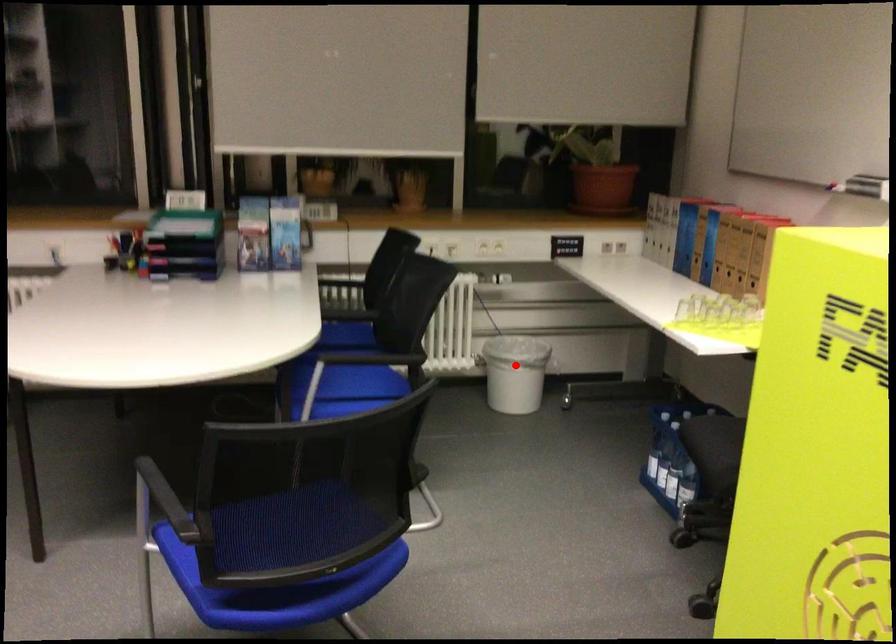
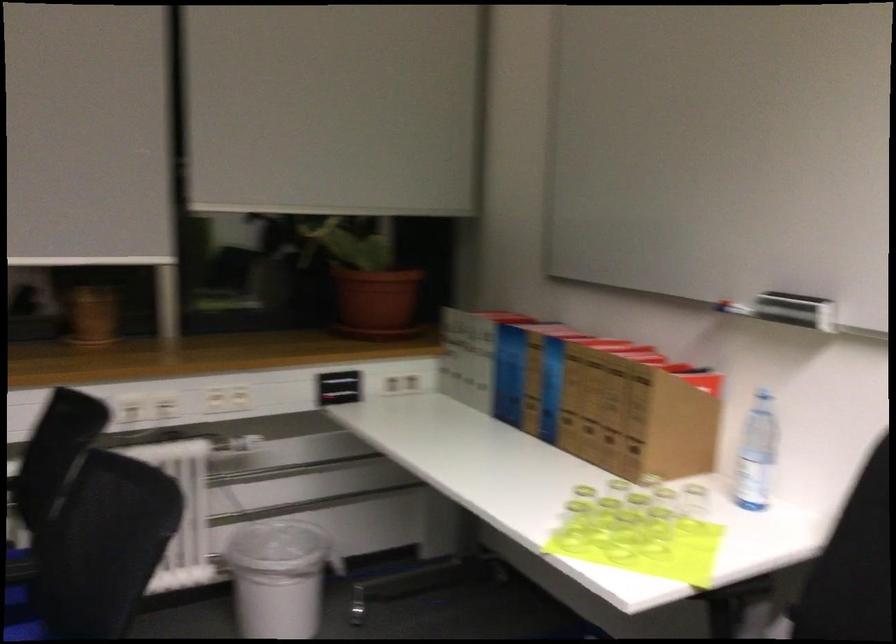
Question: I am providing you with two images of the same scene from different viewpoints. Image1 has a red point marked. In image2, the corresponding 3D location appears at what relative position? Reply with the corresponding letter.

Choices:
 (A) Closer
 (B) Farther

Answer: (A)